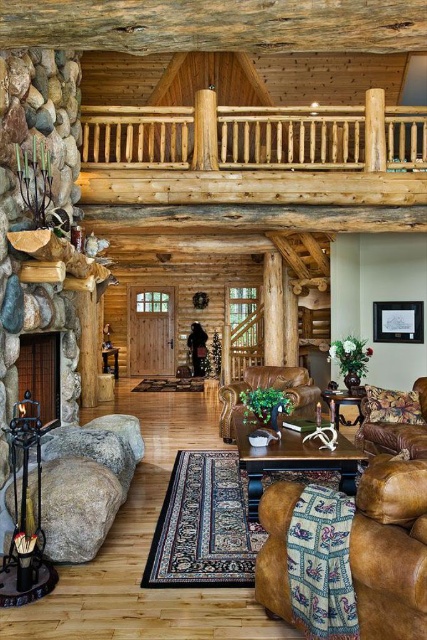
You are planning to rearrange the furniture in the cabin. You have a brown leather armchair at lower right and a matte brown leather side table at lower center. If you want to move both items to the left side near the fireplace, which item would require more space to accommodate?

The matte brown leather side table at lower center requires more space because it occupies more space than the brown leather armchair at lower right according to the description.

You are standing at the center of the room and want to sit down. Where is the brown leather armchair at lower right located in the room?

The brown leather armchair at lower right is located at point (x=391, y=550) in the room.